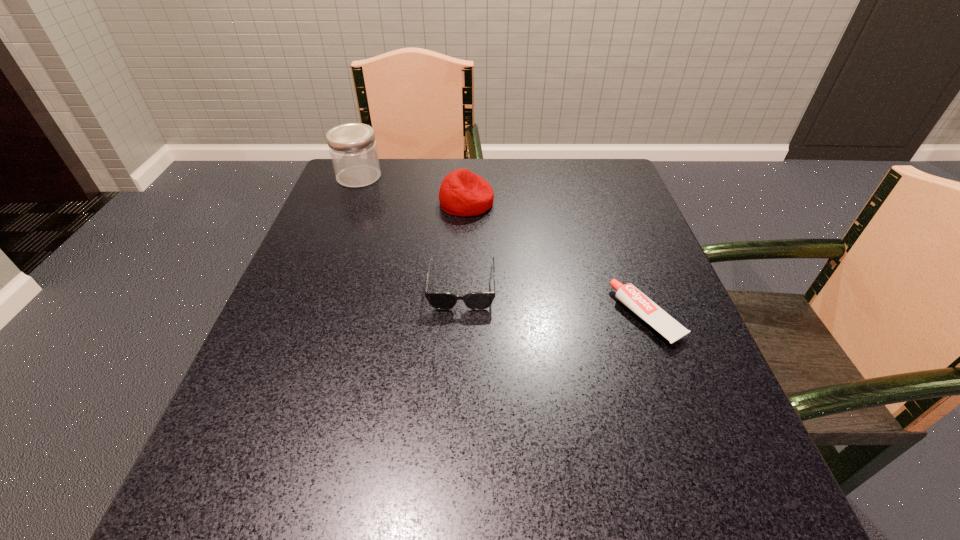
You are a GUI agent. You are given a task and a screenshot of the screen. Output one action in this format:
    pyautogui.click(x=<x>, y=<y>)
    Task: Click on the free region at the far right corner of the desktop
    Image resolution: width=960 pixels, height=540 pixels.
    Given the screenshot: What is the action you would take?
    pyautogui.click(x=623, y=194)

The image size is (960, 540). What are the coordinates of `free spot between the sunglasses and the tallest object` in the screenshot? It's located at (411, 231).

Find the location of `free spot between the beanbag and the rightmost object`. free spot between the beanbag and the rightmost object is located at coordinates (557, 259).

In order to click on empty location between the sunglasses and the rightmost object in this screenshot , I will do `click(555, 301)`.

Where is `free area in between the tallest object and the shortest object`? The width and height of the screenshot is (960, 540). free area in between the tallest object and the shortest object is located at coordinates (503, 247).

Find the location of `empty location between the second shortest object and the tallest object`. empty location between the second shortest object and the tallest object is located at coordinates (411, 231).

Where is `free space between the third shortest object and the rightmost object`? free space between the third shortest object and the rightmost object is located at coordinates (557, 259).

Where is `free point between the tallest object and the shortest object`? This screenshot has height=540, width=960. free point between the tallest object and the shortest object is located at coordinates (503, 247).

Image resolution: width=960 pixels, height=540 pixels. I want to click on vacant region between the leftmost object and the beanbag, so click(413, 190).

Where is `free space between the leftmost object and the second tallest object`? The height and width of the screenshot is (540, 960). free space between the leftmost object and the second tallest object is located at coordinates (413, 190).